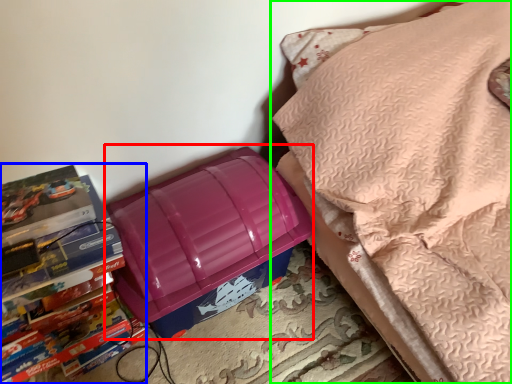
Question: Which object is the farthest from lunch box (highlighted by a red box)? Choose among these: book (highlighted by a blue box) or furniture (highlighted by a green box).

Choices:
 (A) book
 (B) furniture

Answer: (B)